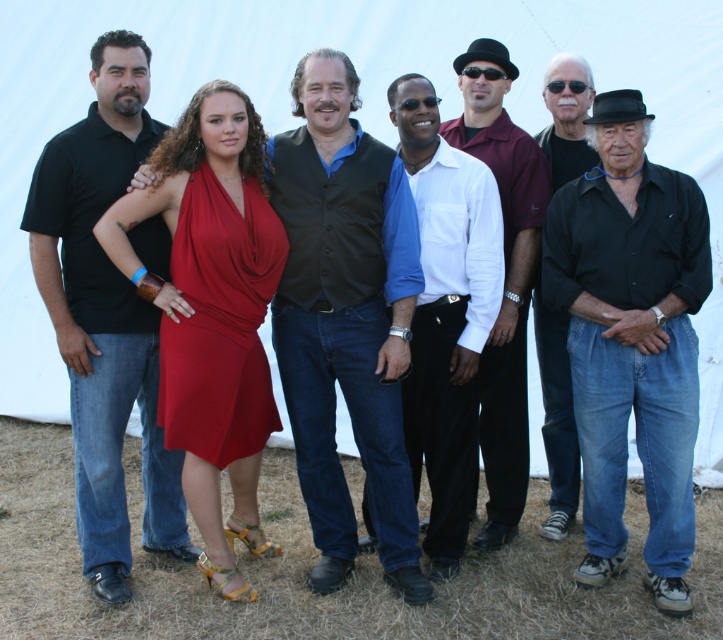
Who is taller, matte red dress at center or matte black shirt at left?

Standing taller between the two is matte black shirt at left.

Locate an element on the screen. matte red dress at center is located at coordinates (213, 312).

Is point (390, 120) positioned before point (504, 456)?

Yes, it is in front of point (504, 456).

Is point (457, 212) behind point (461, 68)?

No, (457, 212) is in front of (461, 68).

Between point (416, 445) and point (479, 397), which one is positioned behind?

Point (479, 397)

Identify the location of blue shirt at center. This screenshot has height=640, width=723. (445, 314).

Is matte black shirt at left taller than blue shirt at center?

Yes, matte black shirt at left is taller than blue shirt at center.

Between matte black shirt at left and blue shirt at center, which one has more height?

matte black shirt at left is taller.

Between point (74, 372) and point (445, 300), which one is positioned behind?

The point (445, 300) is behind.

In order to click on matte black shirt at left in this screenshot , I will do `click(106, 317)`.